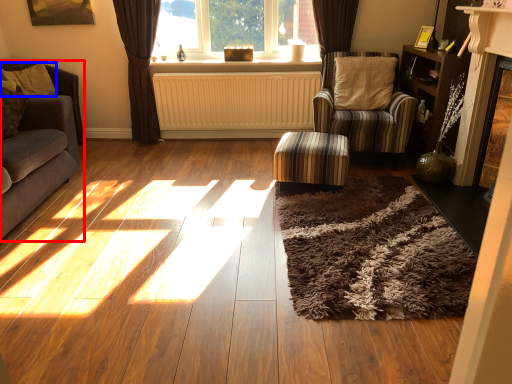
Question: Which of the following is the closest to the observer, studio couch (highlighted by a red box) or pillow (highlighted by a blue box)?

Choices:
 (A) studio couch
 (B) pillow

Answer: (A)